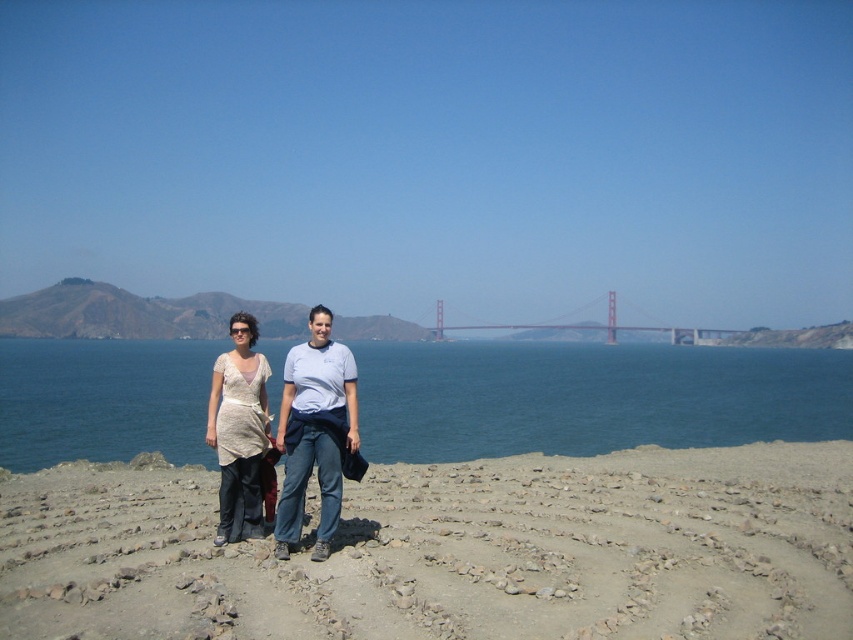
Question: Among these points, which one is nearest to the camera?

Choices:
 (A) (405, 385)
 (B) (312, 387)

Answer: (B)

Question: Observing the image, what is the correct spatial positioning of beige textured dress at center in reference to red painted steel bridge at center?

Choices:
 (A) below
 (B) above

Answer: (A)

Question: Is gray gravel at center below blue water at center?

Choices:
 (A) no
 (B) yes

Answer: (B)

Question: Is matte white blouse at center smaller than red painted steel bridge at center?

Choices:
 (A) yes
 (B) no

Answer: (A)

Question: Among these objects, which one is nearest to the camera?

Choices:
 (A) beige textured dress at center
 (B) blue water at center
 (C) matte white blouse at center

Answer: (C)

Question: Which is nearer to the beige textured dress at center?

Choices:
 (A) gray gravel at center
 (B) blue water at center
 (C) matte white blouse at center

Answer: (C)